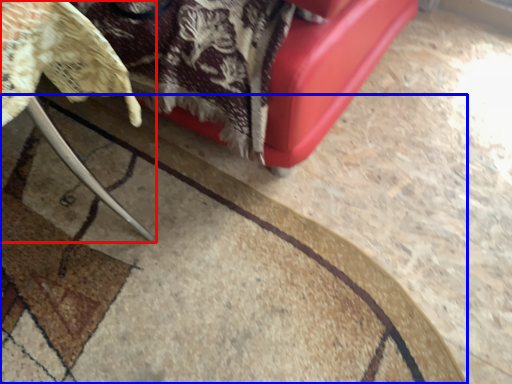
Question: Which point is further to the camera, furniture (highlighted by a red box) or mat (highlighted by a blue box)?

Choices:
 (A) furniture
 (B) mat

Answer: (B)